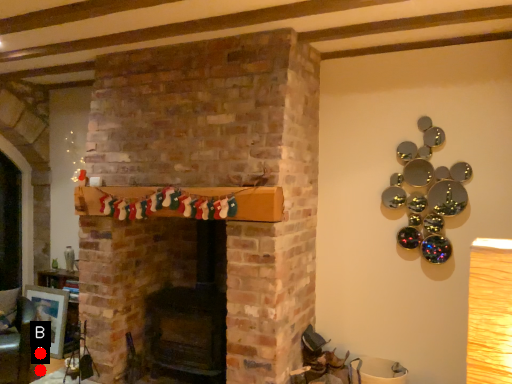
Question: Two points are circled on the image, labeled by A and B beside each circle. Which of the following is the closest to the observer?

Choices:
 (A) A is closer
 (B) B is closer

Answer: (A)